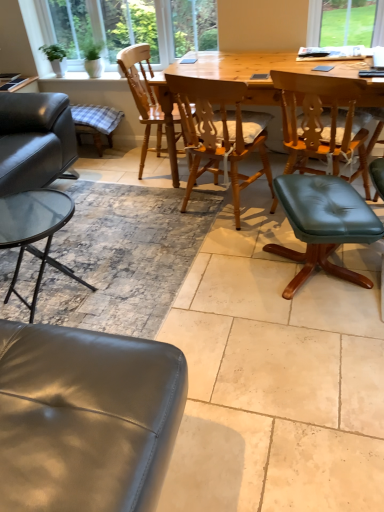
Question: Is the depth of wooden chair at center, which ranks as the 1th chair in left-to-right order, less than that of natural wood table at center?

Choices:
 (A) yes
 (B) no

Answer: (B)

Question: From the image's perspective, is wooden chair at center, which is the 3th chair from right to left, below natural wood table at center?

Choices:
 (A) yes
 (B) no

Answer: (B)

Question: Can you confirm if wooden chair at center, which ranks as the 1th chair in left-to-right order, is bigger than natural wood table at center?

Choices:
 (A) yes
 (B) no

Answer: (B)

Question: Can you confirm if wooden chair at center, which ranks as the 1th chair in left-to-right order, is positioned to the left of natural wood table at center?

Choices:
 (A) no
 (B) yes

Answer: (B)

Question: Is natural wood table at center surrounded by wooden chair at center, which is the 3th chair from right to left?

Choices:
 (A) no
 (B) yes

Answer: (A)

Question: From a real-world perspective, is wooden chair at center, which is the 3th chair from right to left, over natural wood table at center?

Choices:
 (A) no
 (B) yes

Answer: (B)

Question: Can you confirm if teal leather stool at center-right, the 1th bar stool from the bottom, is taller than green leather stool at center, the 1th chair positioned from the right?

Choices:
 (A) no
 (B) yes

Answer: (A)

Question: Is teal leather stool at center-right, the 1th bar stool from the bottom, positioned beyond the bounds of green leather stool at center, the third chair positioned from the left?

Choices:
 (A) yes
 (B) no

Answer: (A)

Question: Is teal leather stool at center-right, the 1th bar stool from the bottom, oriented towards green leather stool at center, the 1th chair positioned from the right?

Choices:
 (A) no
 (B) yes

Answer: (A)

Question: Does teal leather stool at center-right, placed as the first bar stool when sorted from front to back, have a greater width compared to green leather stool at center, the third chair positioned from the left?

Choices:
 (A) no
 (B) yes

Answer: (A)

Question: Is teal leather stool at center-right, positioned as the 2th bar stool in top-to-bottom order, looking in the opposite direction of green leather stool at center, the third chair positioned from the left?

Choices:
 (A) yes
 (B) no

Answer: (B)

Question: From the image's perspective, is teal leather stool at center-right, the 1th bar stool from the bottom, below green leather stool at center, the third chair positioned from the left?

Choices:
 (A) no
 (B) yes

Answer: (B)

Question: From a real-world perspective, does wooden chair at center, which is the 3th chair from right to left, stand above teal leather stool at center-right, the 1th bar stool from the bottom?

Choices:
 (A) yes
 (B) no

Answer: (A)